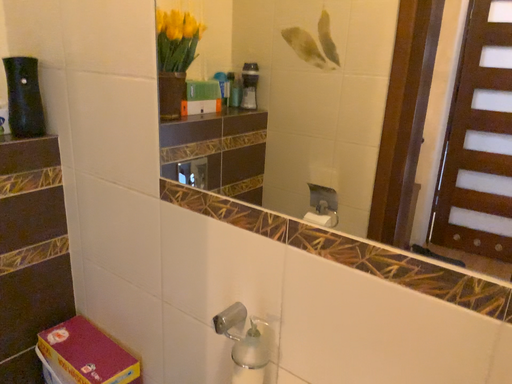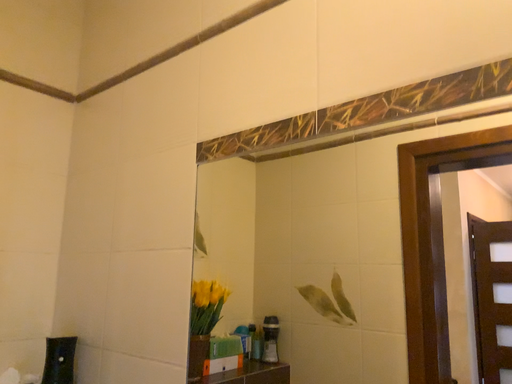
Question: Which way did the camera rotate in the video?

Choices:
 (A) rotated upward
 (B) rotated downward

Answer: (A)